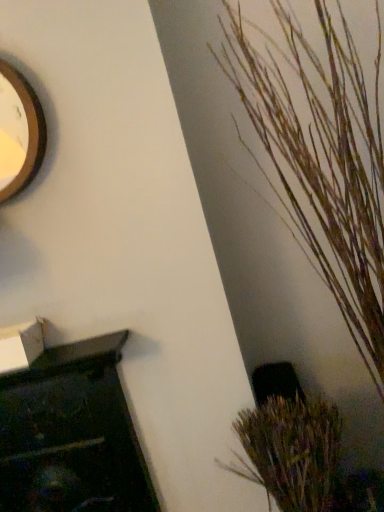
Question: From a real-world perspective, is brown textured plant at lower right, which appears as the 2th houseplant when viewed from the top, positioned above or below wooden textured plant at right, acting as the first houseplant starting from the top?

Choices:
 (A) above
 (B) below

Answer: (B)

Question: In the image, is brown textured plant at lower right, which appears as the 2th houseplant when viewed from the top, on the left side or the right side of wooden textured plant at right, acting as the first houseplant starting from the top?

Choices:
 (A) left
 (B) right

Answer: (A)

Question: Estimate the real-world distances between objects in this image. Which object is farther from the brown textured plant at lower right, the first houseplant from the bottom?

Choices:
 (A) wooden textured plant at right, which ranks as the 2th houseplant in bottom-to-top order
 (B) wooden clock at upper left

Answer: (B)

Question: Estimate the real-world distances between objects in this image. Which object is closer to the wooden clock at upper left?

Choices:
 (A) wooden textured plant at right, which ranks as the 2th houseplant in bottom-to-top order
 (B) brown textured plant at lower right, which appears as the 2th houseplant when viewed from the top

Answer: (A)